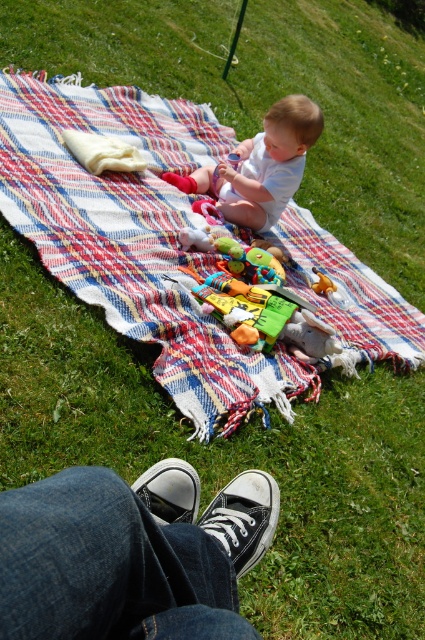
Question: From the image, what is the correct spatial relationship of white canvas shoes at lower center in relation to smooth white baby at center?

Choices:
 (A) below
 (B) above

Answer: (A)

Question: Which point appears farthest from the camera in this image?

Choices:
 (A) (266, 400)
 (B) (252, 264)
 (C) (200, 232)

Answer: (C)

Question: Is plush multicolored stuffed animal at center above rubberized plastic toy at center?

Choices:
 (A) no
 (B) yes

Answer: (A)

Question: Which of the following is the farthest from the observer?

Choices:
 (A) smooth white baby at center
 (B) plaid fabric blanket at center

Answer: (A)

Question: Does smooth white baby at center have a greater width compared to plush multicolored stuffed animal at center?

Choices:
 (A) yes
 (B) no

Answer: (A)

Question: Which of the following is the farthest from the observer?

Choices:
 (A) (312, 288)
 (B) (282, 280)
 (C) (328, 257)

Answer: (C)